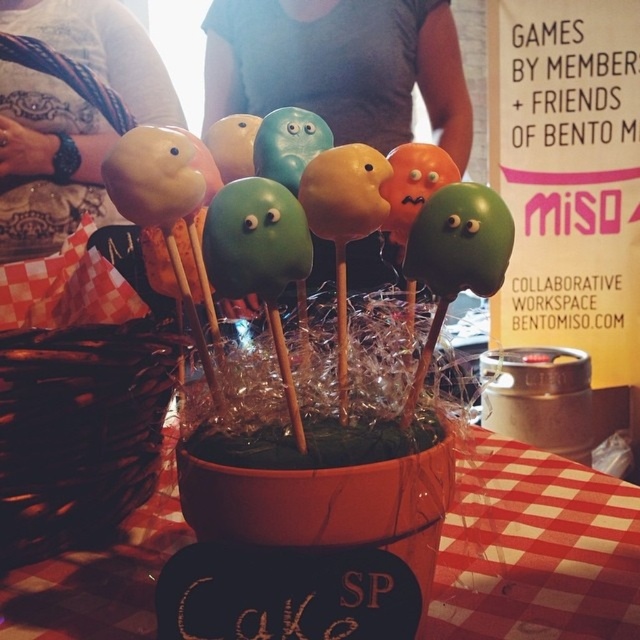
You are a customer at a bakery and want to buy the cake pops displayed in the black container with the word Cake. You notice a point marked at coordinates (x=340, y=67). What object is located at that point?

The point at coordinates (x=340, y=67) indicates the matte gray shirt at center.

Looking at this image, you are a baker who needs to place a 20 inch long cake decoration between the brown woven basket at center and the matte black cake pops at left. Can you fit it without moving either object?

The brown woven basket at center and the matte black cake pops at left are 25.68 inches apart, so yes, the 20 inch long cake decoration can fit between them since it is shorter than the distance between the two objects.

You are looking at the cake pops arranged in the container on the checkered tablecloth. There are two points marked in the image. Which point, point (38, 612) or point (104, 216), is closer to you?

Point (38, 612) is closer to you than point (104, 216).